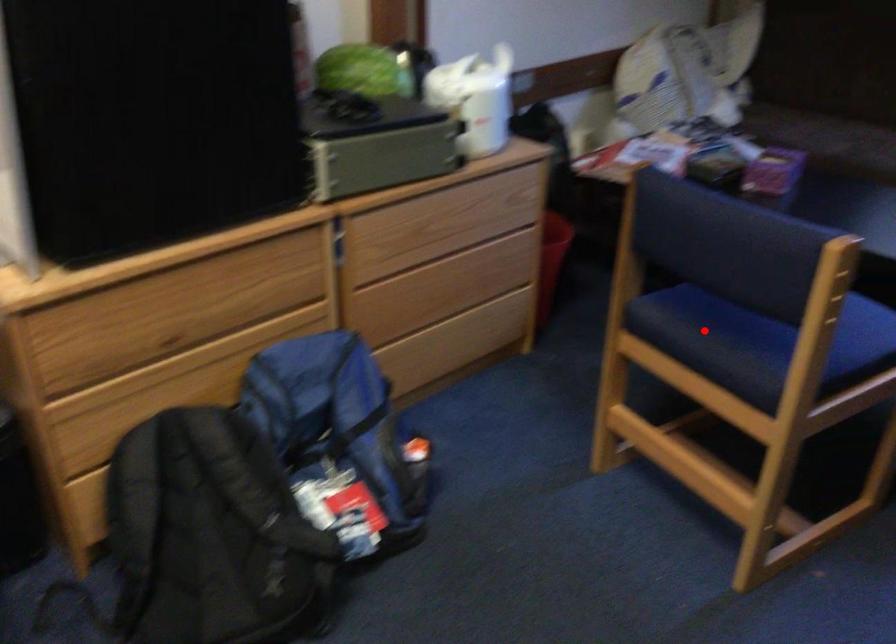
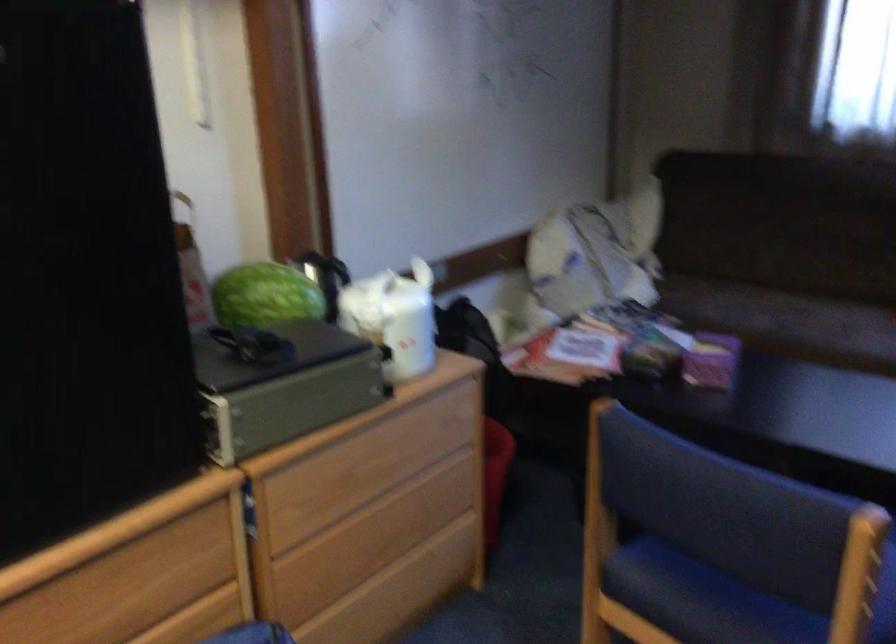
Find the pixel in the second image that matches the highlighted location in the first image.

(702, 599)